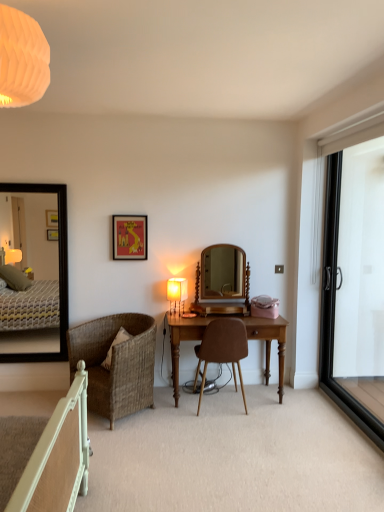
Question: Relative to matte white power outlet at center-right, is wooden mirror at center, which appears as the 2th mirror when viewed from the left, in front or behind?

Choices:
 (A) behind
 (B) front

Answer: (B)

Question: Considering the positions of wooden mirror at center, which appears as the 2th mirror when viewed from the left, and matte white power outlet at center-right in the image, is wooden mirror at center, which appears as the 2th mirror when viewed from the left, taller or shorter than matte white power outlet at center-right?

Choices:
 (A) tall
 (B) short

Answer: (A)

Question: Estimate the real-world distances between objects in this image. Which object is closer to the wooden desk at center?

Choices:
 (A) matte white power outlet at center-right
 (B) matte red picture frame at upper center
 (C) black framed mirror at left, the first mirror positioned from the left
 (D) black glass screen door at right
 (E) brown leather chair at center, which appears as the second chair when viewed from the left

Answer: (E)

Question: Which object is positioned closest to the brown leather chair at center, marked as the first chair in a right-to-left arrangement?

Choices:
 (A) matte red picture frame at upper center
 (B) wooden mirror at center, which appears as the 2th mirror when viewed from the left
 (C) matte white power outlet at center-right
 (D) matte orange lampshade at upper left, which is the 1th lamp from top to bottom
 (E) wooden desk at center

Answer: (E)